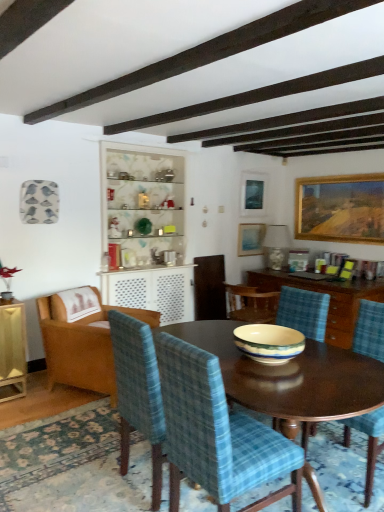
You are a GUI agent. You are given a task and a screenshot of the screen. Output one action in this format:
    pyautogui.click(x=<x>, y=<y>)
    Task: Click on the porcelain bowl at center
    The height and width of the screenshot is (512, 384).
    Given the screenshot: What is the action you would take?
    pyautogui.click(x=269, y=343)

What do you see at coordinates (340, 208) in the screenshot? I see `gold-framed painting at upper right, the 3th picture frame in the left-to-right sequence` at bounding box center [340, 208].

Describe the element at coordinates (217, 433) in the screenshot. Image resolution: width=384 pixels, height=512 pixels. I see `blue plaid chair at center, positioned as the second chair in right-to-left order` at that location.

Describe the element at coordinates (146, 229) in the screenshot. The height and width of the screenshot is (512, 384). I see `white glossy cabinet at center` at that location.

What is the approximate height of blue plaid chair at center, which ranks as the second chair in left-to-right order?

blue plaid chair at center, which ranks as the second chair in left-to-right order, is 38.97 inches in height.

Identify the location of matte glass picture frame at upper center, arranged as the 2th picture frame when viewed from the right. (253, 193).

Which is correct: matte blue picture frame at upper center, which ranks as the first picture frame in left-to-right order, is inside white glossy cabinet at center, or outside of it?

matte blue picture frame at upper center, which ranks as the first picture frame in left-to-right order, is not enclosed by white glossy cabinet at center.

Based on the photo, between matte blue picture frame at upper center, which ranks as the first picture frame in left-to-right order, and white glossy cabinet at center, which one appears on the left side from the viewer's perspective?

From the viewer's perspective, white glossy cabinet at center appears more on the left side.

Is matte blue picture frame at upper center, which ranks as the first picture frame in left-to-right order, aimed at white glossy cabinet at center?

No, matte blue picture frame at upper center, which ranks as the first picture frame in left-to-right order, is not turned towards white glossy cabinet at center.

Can you tell me how much matte blue picture frame at upper center, which ranks as the first picture frame in left-to-right order, and white glossy cabinet at center differ in facing direction?

3.97 degrees.

What are the coordinates of `cabinetry located on the right of matte blue picture frame at upper center, which ranks as the third picture frame in right-to-left order` in the screenshot? It's located at (330, 298).

Is matte blue picture frame at upper center, which ranks as the third picture frame in right-to-left order, looking in the opposite direction of wooden cabinet at center?

No, matte blue picture frame at upper center, which ranks as the third picture frame in right-to-left order,'s orientation is not away from wooden cabinet at center.

Is point (251, 228) less distant than point (254, 285)?

No, (251, 228) is behind (254, 285).

Is matte blue picture frame at upper center, which ranks as the third picture frame in right-to-left order, far away from wooden cabinet at center?

Yes.

Considering the relative sizes of wooden cabinet at center and gold-framed painting at upper right, the 3th picture frame in the left-to-right sequence, in the image provided, is wooden cabinet at center bigger than gold-framed painting at upper right, the 3th picture frame in the left-to-right sequence,?

Correct, wooden cabinet at center is larger in size than gold-framed painting at upper right, the 3th picture frame in the left-to-right sequence.

Between wooden cabinet at center and gold-framed painting at upper right, the 3th picture frame in the left-to-right sequence, which one has more height?

Standing taller between the two is gold-framed painting at upper right, the 3th picture frame in the left-to-right sequence.

What's the angular difference between wooden cabinet at center and gold-framed painting at upper right, the 3th picture frame in the left-to-right sequence,'s facing directions?

The angular difference between wooden cabinet at center and gold-framed painting at upper right, the 3th picture frame in the left-to-right sequence, is 1.04 degrees.

Between wooden armchair at left, the first chair viewed from the left, and matte glass picture frame at upper center, placed as the second picture frame when sorted from left to right, which one has smaller width?

With smaller width is matte glass picture frame at upper center, placed as the second picture frame when sorted from left to right.

Does wooden armchair at left, positioned as the fourth chair in right-to-left order, lie in front of matte glass picture frame at upper center, arranged as the 2th picture frame when viewed from the right?

That is True.

From a real-world perspective, between wooden armchair at left, positioned as the fourth chair in right-to-left order, and matte glass picture frame at upper center, arranged as the 2th picture frame when viewed from the right, who is vertically higher?

matte glass picture frame at upper center, arranged as the 2th picture frame when viewed from the right, is physically above.

Is wooden armchair at left, the first chair viewed from the left, shorter than matte glass picture frame at upper center, arranged as the 2th picture frame when viewed from the right?

In fact, wooden armchair at left, the first chair viewed from the left, may be taller than matte glass picture frame at upper center, arranged as the 2th picture frame when viewed from the right.

Considering the relative sizes of blue plaid chair at center, the first chair in the right-to-left sequence, and wooden cabinet at center in the image provided, is blue plaid chair at center, the first chair in the right-to-left sequence, taller than wooden cabinet at center?

Yes, blue plaid chair at center, the first chair in the right-to-left sequence, is taller than wooden cabinet at center.

Can wooden cabinet at center be found inside blue plaid chair at center, the 4th chair from the left?

No, wooden cabinet at center is located outside of blue plaid chair at center, the 4th chair from the left.

Is blue plaid chair at center, the 4th chair from the left, positioned with its back to wooden cabinet at center?

blue plaid chair at center, the 4th chair from the left, is not turned away from wooden cabinet at center.

Is blue plaid chair at center, the 4th chair from the left, further to camera compared to wooden cabinet at center?

No, blue plaid chair at center, the 4th chair from the left, is closer to the viewer.

Based on the photo, would you say blue plaid chair at center, the 4th chair from the left, is outside matte blue picture frame at upper center, which ranks as the first picture frame in left-to-right order?

Yes.

Between blue plaid chair at center, the 4th chair from the left, and matte blue picture frame at upper center, which ranks as the first picture frame in left-to-right order, which one has less height?

Standing shorter between the two is matte blue picture frame at upper center, which ranks as the first picture frame in left-to-right order.

Which point is more distant from viewer, [376,335] or [243,233]?

The point [243,233] is farther from the camera.

Which object is positioned more to the right, blue plaid chair at center, the first chair in the right-to-left sequence, or matte blue picture frame at upper center, which ranks as the third picture frame in right-to-left order?

blue plaid chair at center, the first chair in the right-to-left sequence.

Which is in front, blue plaid chair at center, which is counted as the third chair, starting from the right, or blue plaid chair at center, the third chair from the left?

blue plaid chair at center, the third chair from the left.

From a real-world perspective, which object stands above the other?

From a 3D spatial view, blue plaid chair at center, the third chair from the left, is above.

Is point (123, 448) less distant than point (157, 356)?

No, it is behind (157, 356).

How much distance is there between blue plaid chair at center, which is counted as the third chair, starting from the right, and blue plaid chair at center, the third chair from the left?

The distance of blue plaid chair at center, which is counted as the third chair, starting from the right, from blue plaid chair at center, the third chair from the left, is 11.43 inches.

Find the location of `bookshelf that is above the matte blue picture frame at upper center, which ranks as the third picture frame in right-to-left order (from a real-world perspective)`. bookshelf that is above the matte blue picture frame at upper center, which ranks as the third picture frame in right-to-left order (from a real-world perspective) is located at coordinates (146, 229).

Starting from the wooden cabinet at center, which picture frame is the 3rd one behind? Please provide its 2D coordinates.

[(250, 238)]

Estimate the real-world distances between objects in this image. Which object is closer to porcelain bowl at center, wooden cabinet at center or blue plaid chair at center, positioned as the second chair in right-to-left order?

blue plaid chair at center, positioned as the second chair in right-to-left order, is closer to porcelain bowl at center.

Based on their spatial positions, is wooden table at center or matte blue picture frame at upper center, which ranks as the first picture frame in left-to-right order, closer to white glossy cabinet at center?

The object closer to white glossy cabinet at center is matte blue picture frame at upper center, which ranks as the first picture frame in left-to-right order.

When comparing their distances from matte blue picture frame at upper center, which ranks as the first picture frame in left-to-right order, does matte glass picture frame at upper center, arranged as the 2th picture frame when viewed from the right, or white glossy cabinet at center seem further?

Among the two, white glossy cabinet at center is located further to matte blue picture frame at upper center, which ranks as the first picture frame in left-to-right order.

When comparing their distances from wooden table at center, does porcelain bowl at center or gold-framed painting at upper right, the first picture frame viewed from the right, seem closer?

porcelain bowl at center.

Based on their spatial positions, is matte blue picture frame at upper center, which ranks as the third picture frame in right-to-left order, or wooden armchair at left, the first chair viewed from the left, further from wooden cabinet at center?

wooden armchair at left, the first chair viewed from the left, is further to wooden cabinet at center.

Estimate the real-world distances between objects in this image. Which object is further from blue plaid chair at center, the 4th chair from the left, blue plaid chair at center, which is counted as the third chair, starting from the right, or porcelain bowl at center?

Based on the image, blue plaid chair at center, which is counted as the third chair, starting from the right, appears to be further to blue plaid chair at center, the 4th chair from the left.

When comparing their distances from white fabric lampshade at upper center, does gold-framed painting at upper right, the first picture frame viewed from the right, or blue plaid chair at center, which is counted as the third chair, starting from the right, seem further?

blue plaid chair at center, which is counted as the third chair, starting from the right, lies further to white fabric lampshade at upper center than the other object.

Considering their positions, is porcelain bowl at center positioned closer to blue plaid chair at center, the first chair in the right-to-left sequence, than matte blue picture frame at upper center, which ranks as the third picture frame in right-to-left order?

Based on the image, matte blue picture frame at upper center, which ranks as the third picture frame in right-to-left order, appears to be nearer to blue plaid chair at center, the first chair in the right-to-left sequence.

Where is `bowl between blue plaid chair at center, which is counted as the third chair, starting from the right, and matte blue picture frame at upper center, which ranks as the first picture frame in left-to-right order, in the front-back direction`? The image size is (384, 512). bowl between blue plaid chair at center, which is counted as the third chair, starting from the right, and matte blue picture frame at upper center, which ranks as the first picture frame in left-to-right order, in the front-back direction is located at coordinates (269, 343).

Where is `bookshelf between wooden table at center and wooden cabinet at center in the front-back direction`? Image resolution: width=384 pixels, height=512 pixels. bookshelf between wooden table at center and wooden cabinet at center in the front-back direction is located at coordinates (146, 229).

I want to click on bookshelf between blue plaid chair at center, the 4th chair from the left, and gold-framed painting at upper right, the first picture frame viewed from the right, along the z-axis, so (146, 229).

The width and height of the screenshot is (384, 512). Find the location of `bowl located between blue plaid chair at center, the third chair from the left, and white fabric lampshade at upper center in the depth direction`. bowl located between blue plaid chair at center, the third chair from the left, and white fabric lampshade at upper center in the depth direction is located at coordinates (269, 343).